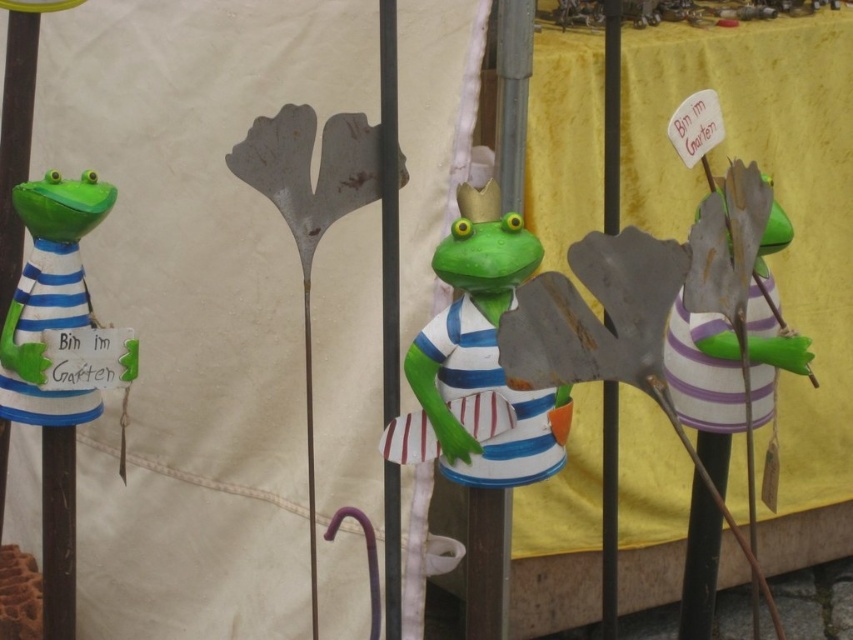
Question: Is matte green frog at center behind green matte frog at left?

Choices:
 (A) no
 (B) yes

Answer: (A)

Question: Does matte green frog at center have a smaller size compared to green matte frog at left?

Choices:
 (A) yes
 (B) no

Answer: (B)

Question: Is matte green frog at center further to the viewer compared to green matte frog at left?

Choices:
 (A) yes
 (B) no

Answer: (B)

Question: Which point appears closest to the camera in this image?

Choices:
 (A) (459, 253)
 (B) (38, 376)

Answer: (A)

Question: Which object is closer to the camera taking this photo?

Choices:
 (A) green matte frog at left
 (B) matte green frog at center

Answer: (B)